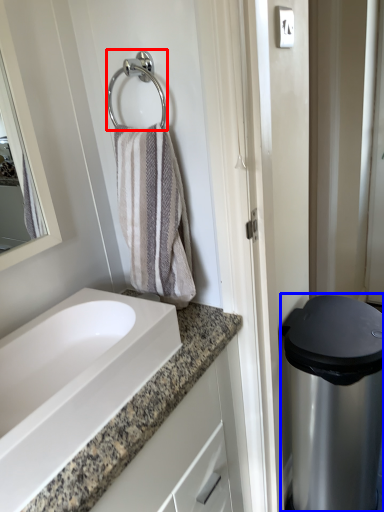
Question: Which point is further to the camera, shower (highlighted by a red box) or appliance (highlighted by a blue box)?

Choices:
 (A) shower
 (B) appliance

Answer: (B)